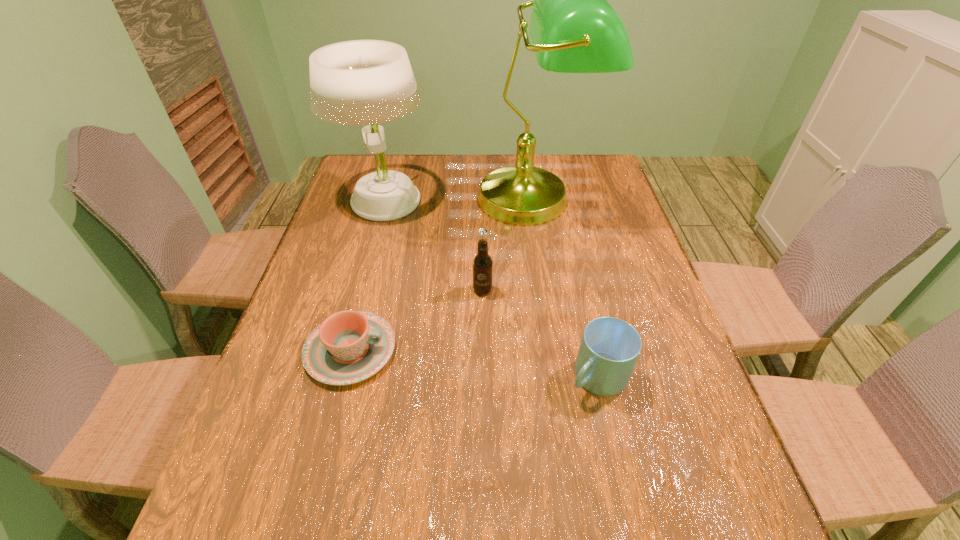
At what (x,y) coordinates should I click in order to perform the action: click on vacant space at the left edge of the desktop. Please return your answer as a coordinate pair (x, y). Looking at the image, I should click on (329, 244).

Find the location of a particular element. The height and width of the screenshot is (540, 960). vacant space at the near left corner of the desktop is located at coordinates (279, 523).

In the image, there is a desktop. At what (x,y) coordinates should I click in order to perform the action: click on vacant region at the far right corner. Please return your answer as a coordinate pair (x, y). The image size is (960, 540). Looking at the image, I should click on (580, 157).

Identify the location of vacant space that is in between the root beer and the right lamp. This screenshot has height=540, width=960. (508, 245).

This screenshot has height=540, width=960. What are the coordinates of `free point between the third farthest object and the mug` in the screenshot? It's located at (540, 334).

The image size is (960, 540). I want to click on free space between the shortest object and the left lamp, so click(x=368, y=276).

At what (x,y) coordinates should I click in order to perform the action: click on free space between the shortest object and the taller lamp. Please return your answer as a coordinate pair (x, y). This screenshot has width=960, height=540. Looking at the image, I should click on click(x=443, y=274).

Locate an element on the screen. Image resolution: width=960 pixels, height=540 pixels. free spot between the left lamp and the root beer is located at coordinates click(433, 246).

This screenshot has width=960, height=540. I want to click on unoccupied position between the tallest object and the second tallest object, so click(459, 200).

Where is `vacant space in between the tallest object and the chinaware`? This screenshot has height=540, width=960. vacant space in between the tallest object and the chinaware is located at coordinates (443, 274).